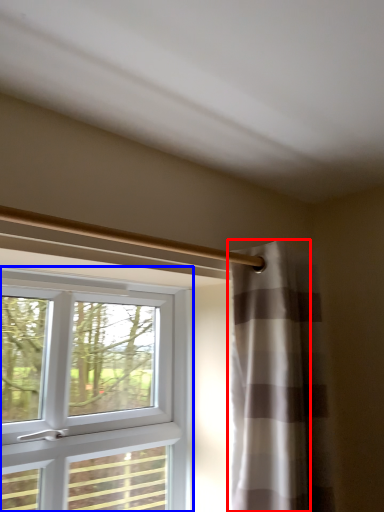
Question: Which point is closer to the camera, curtain (highlighted by a red box) or window (highlighted by a blue box)?

Choices:
 (A) curtain
 (B) window

Answer: (B)